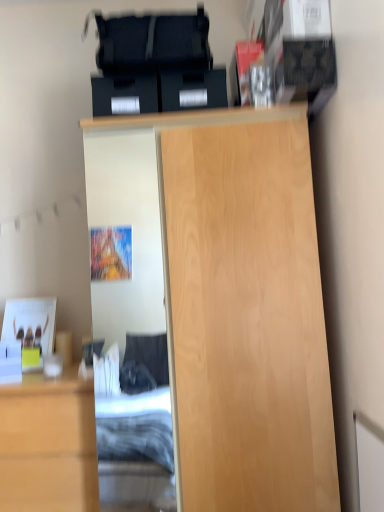
Question: Is light wood cabinet at lower left oriented away from light wood cupboard at center?

Choices:
 (A) yes
 (B) no

Answer: (B)

Question: Can you confirm if light wood cabinet at lower left is bigger than light wood cupboard at center?

Choices:
 (A) yes
 (B) no

Answer: (B)

Question: Does light wood cabinet at lower left have a lesser width compared to light wood cupboard at center?

Choices:
 (A) no
 (B) yes

Answer: (B)

Question: Can you confirm if light wood cabinet at lower left is shorter than light wood cupboard at center?

Choices:
 (A) no
 (B) yes

Answer: (B)

Question: Is light wood cabinet at lower left not close to light wood cupboard at center?

Choices:
 (A) no
 (B) yes

Answer: (A)

Question: Is light wood cabinet at lower left further to the viewer compared to light wood cupboard at center?

Choices:
 (A) yes
 (B) no

Answer: (A)

Question: Is light wood cabinet at lower left surrounded by light wood cupboard at center?

Choices:
 (A) yes
 (B) no

Answer: (B)

Question: Is light wood cupboard at center further to the viewer compared to light wood cabinet at lower left?

Choices:
 (A) yes
 (B) no

Answer: (B)

Question: Considering the relative positions of light wood cupboard at center and light wood cabinet at lower left in the image provided, is light wood cupboard at center to the right of light wood cabinet at lower left from the viewer's perspective?

Choices:
 (A) yes
 (B) no

Answer: (A)

Question: Does light wood cupboard at center turn towards light wood cabinet at lower left?

Choices:
 (A) no
 (B) yes

Answer: (A)

Question: Considering the relative sizes of light wood cupboard at center and light wood cabinet at lower left in the image provided, is light wood cupboard at center bigger than light wood cabinet at lower left?

Choices:
 (A) yes
 (B) no

Answer: (A)

Question: Would you say light wood cupboard at center is outside light wood cabinet at lower left?

Choices:
 (A) no
 (B) yes

Answer: (B)

Question: From a real-world perspective, relative to light wood cabinet at lower left, is light wood cupboard at center vertically above or below?

Choices:
 (A) above
 (B) below

Answer: (A)